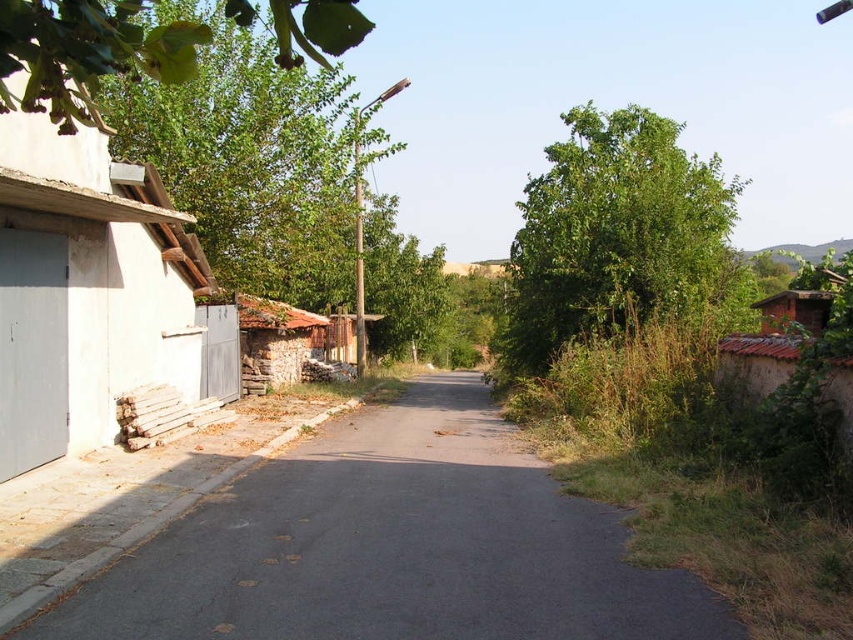
You are a delivery driver who needs to park your truck near the white concrete hut at left without blocking the road. The truck is 2 meters wide. Can you park on the asphalt at center? Explain your reasoning based on their positions.

The asphalt at center is to the right of the white concrete hut at left. Since the truck is 2 meters wide, parking on the asphalt at center would place it away from the hut, but you must ensure it doesn not block the road. However, the description doesn not provide the width of the road or the distance between the hut and asphalt to confirm if parking there would block traffic. More information is needed.